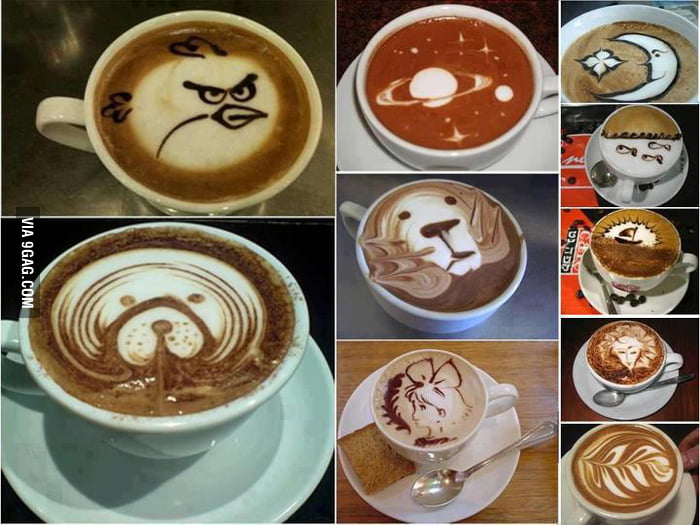
Find the location of a particular element. This screenshot has height=525, width=700. plater under coffee cup is located at coordinates (287, 455), (542, 145), (494, 487), (682, 517), (651, 395), (673, 303), (668, 193).